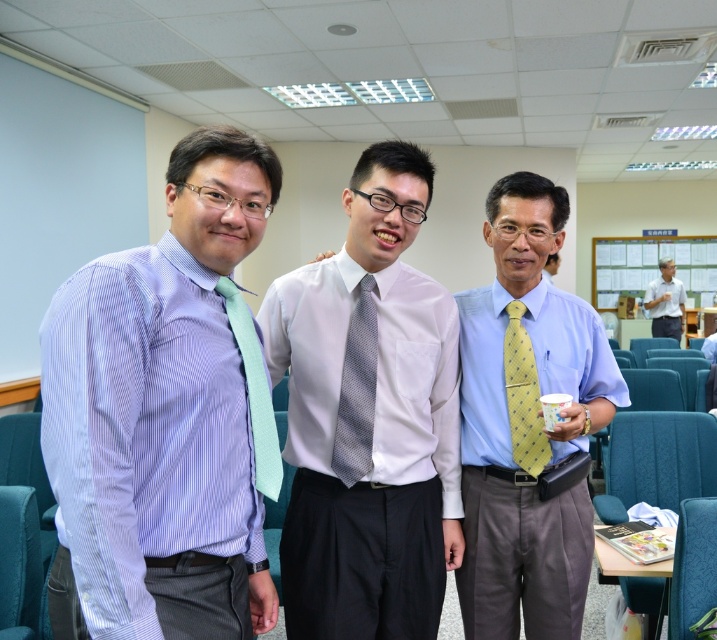
Question: Which of the following is the farthest from the observer?

Choices:
 (A) (366, 602)
 (B) (550, 282)

Answer: (B)

Question: Is white textured shirt at center thinner than light blue shirt at center?

Choices:
 (A) yes
 (B) no

Answer: (A)

Question: Is the position of matte blue shirt at left less distant than that of yellow textured tie at center?

Choices:
 (A) yes
 (B) no

Answer: (A)

Question: Which object is positioned farthest from the yellow dotted tie at center?

Choices:
 (A) matte blue shirt at left
 (B) light blue shirt at center
 (C) yellow dotted tie at right

Answer: (B)

Question: Can you confirm if white textured shirt at center is positioned to the left of yellow dotted tie at right?

Choices:
 (A) yes
 (B) no

Answer: (A)

Question: Which point appears closest to the camera in this image?

Choices:
 (A) (673, 280)
 (B) (147, 620)
 (C) (242, 310)

Answer: (B)